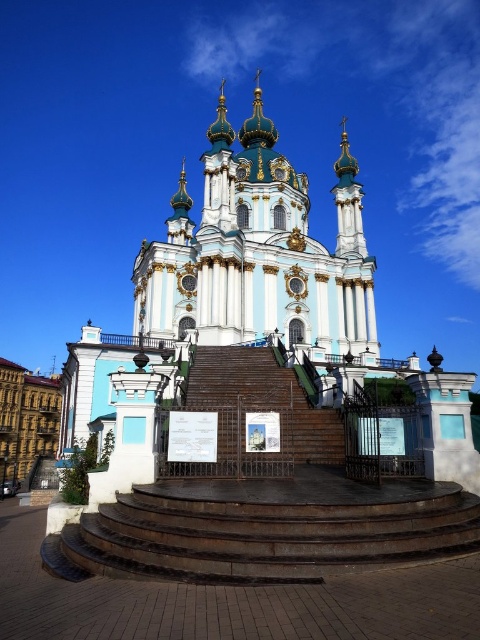
Is white marble church at center in front of dark brown stone stairs at center?

No, it is not.

Is white marble church at center to the left of dark brown stone stairs at center from the viewer's perspective?

No, white marble church at center is not to the left of dark brown stone stairs at center.

You are a GUI agent. You are given a task and a screenshot of the screen. Output one action in this format:
    pyautogui.click(x=<x>, y=<y>)
    Task: Click on the white marble church at center
    
    Given the screenshot: What is the action you would take?
    pyautogui.click(x=242, y=276)

Who is taller, dark brown stone stairs at center or brown wooden stairs at center?

Standing taller between the two is brown wooden stairs at center.

The height and width of the screenshot is (640, 480). Identify the location of dark brown stone stairs at center. (264, 529).

Between point (303, 214) and point (255, 365), which one is positioned in front?

Point (255, 365) is in front.

Consider the image. Can you confirm if white marble church at center is taller than brown wooden stairs at center?

Indeed, white marble church at center has a greater height compared to brown wooden stairs at center.

Measure the distance between point (x=95, y=333) and camera.

A distance of 65.72 meters exists between point (x=95, y=333) and camera.

I want to click on white marble church at center, so click(x=242, y=276).